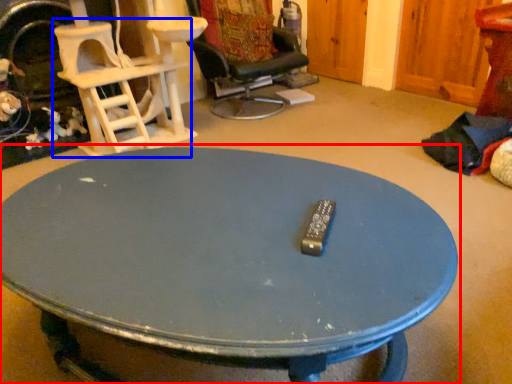
Question: Among these objects, which one is nearest to the camera, coffee table (highlighted by a red box) or chair (highlighted by a blue box)?

Choices:
 (A) coffee table
 (B) chair

Answer: (A)